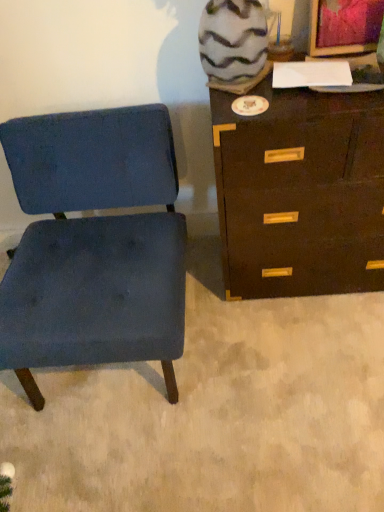
Question: Does dark brown wood chest of drawers at right contain blue fabric chair at left?

Choices:
 (A) yes
 (B) no

Answer: (B)

Question: Is dark brown wood chest of drawers at right positioned far away from blue fabric chair at left?

Choices:
 (A) yes
 (B) no

Answer: (B)

Question: Considering the relative sizes of dark brown wood chest of drawers at right and blue fabric chair at left in the image provided, is dark brown wood chest of drawers at right bigger than blue fabric chair at left?

Choices:
 (A) no
 (B) yes

Answer: (A)

Question: From a real-world perspective, is dark brown wood chest of drawers at right physically below blue fabric chair at left?

Choices:
 (A) yes
 (B) no

Answer: (B)

Question: Is dark brown wood chest of drawers at right at the right side of blue fabric chair at left?

Choices:
 (A) yes
 (B) no

Answer: (A)

Question: Is dark brown wood chest of drawers at right at the left side of blue fabric chair at left?

Choices:
 (A) yes
 (B) no

Answer: (B)

Question: Is blue fabric chair at left turned away from dark brown wood chest of drawers at right?

Choices:
 (A) yes
 (B) no

Answer: (B)

Question: Does blue fabric chair at left have a greater height compared to dark brown wood chest of drawers at right?

Choices:
 (A) no
 (B) yes

Answer: (A)

Question: Is blue fabric chair at left shorter than dark brown wood chest of drawers at right?

Choices:
 (A) no
 (B) yes

Answer: (B)

Question: Does blue fabric chair at left appear on the right side of dark brown wood chest of drawers at right?

Choices:
 (A) yes
 (B) no

Answer: (B)

Question: Is blue fabric chair at left at the left side of dark brown wood chest of drawers at right?

Choices:
 (A) no
 (B) yes

Answer: (B)

Question: From the image's perspective, would you say blue fabric chair at left is shown under dark brown wood chest of drawers at right?

Choices:
 (A) no
 (B) yes

Answer: (B)

Question: In terms of width, does dark brown wood chest of drawers at right look wider or thinner when compared to blue fabric chair at left?

Choices:
 (A) thin
 (B) wide

Answer: (A)